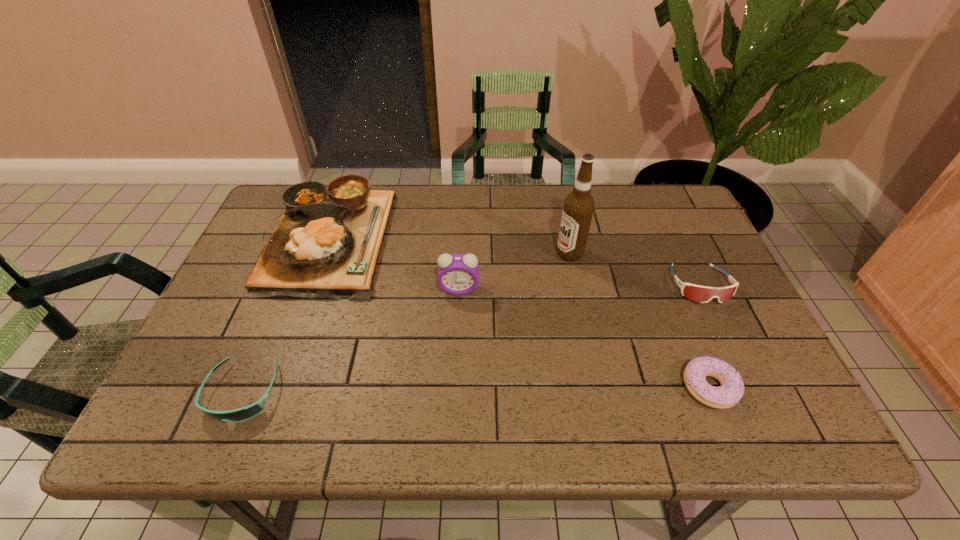
Identify the location of empty space between the platter and the doughnut. This screenshot has width=960, height=540. (519, 313).

Where is `free area in between the goggles and the sunglasses`? This screenshot has height=540, width=960. free area in between the goggles and the sunglasses is located at coordinates (471, 339).

At what (x,y) coordinates should I click in order to perform the action: click on free area in between the doughnut and the third object from right to left. Please return your answer as a coordinate pair (x, y). This screenshot has height=540, width=960. Looking at the image, I should click on (639, 320).

I want to click on vacant space in between the sunglasses and the third object from left to right, so click(x=351, y=340).

This screenshot has height=540, width=960. What are the coordinates of `vacant space that's between the sunglasses and the fourth shortest object` in the screenshot? It's located at (286, 315).

Locate an element on the screen. The height and width of the screenshot is (540, 960). vacant area between the third object from right to left and the sunglasses is located at coordinates (406, 323).

This screenshot has width=960, height=540. I want to click on vacant point located between the doughnut and the sunglasses, so click(476, 390).

At what (x,y) coordinates should I click in order to perform the action: click on free space that is in between the sunglasses and the second tallest object. Please return your answer as a coordinate pair (x, y). Looking at the image, I should click on (351, 340).

I want to click on unoccupied area between the doughnut and the third object from left to right, so click(x=584, y=338).

The height and width of the screenshot is (540, 960). In order to click on free space between the fourth tallest object and the doughnut in this screenshot , I will do (705, 336).